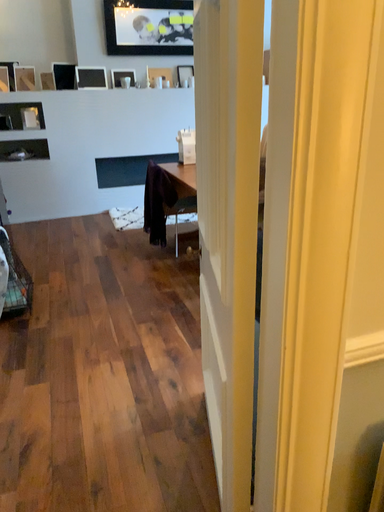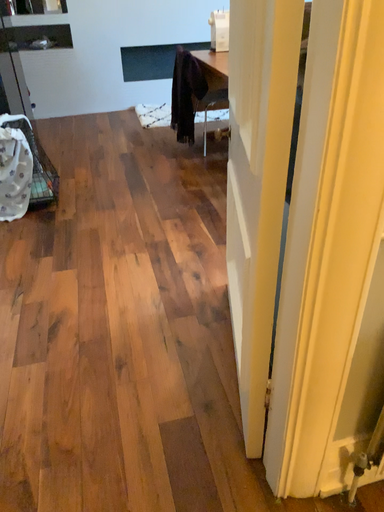
Question: Which way did the camera rotate in the video?

Choices:
 (A) rotated downward
 (B) rotated upward

Answer: (A)